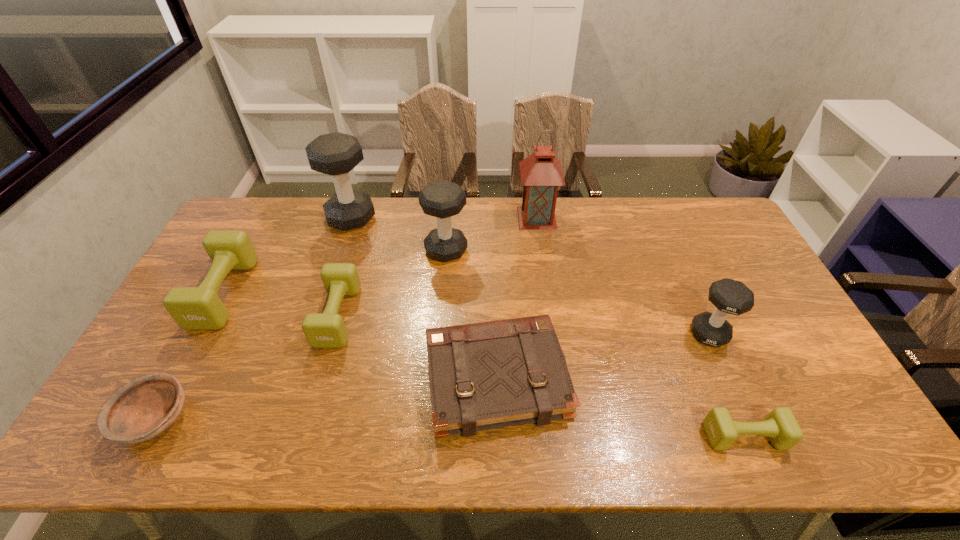
I want to click on olive dumbbell object that ranks as the closest to the fourth dumbbell from left to right, so click(322, 330).

Locate an element on the screen. This screenshot has width=960, height=540. vacant position in the image that satisfies the following two spatial constraints: 1. on the back side of the third tallest dumbbell; 2. on the left side of the brown bowl is located at coordinates (202, 334).

Where is `free space that satisfies the following two spatial constraints: 1. on the back side of the leftmost olive dumbbell; 2. on the right side of the pink lantern`? The image size is (960, 540). free space that satisfies the following two spatial constraints: 1. on the back side of the leftmost olive dumbbell; 2. on the right side of the pink lantern is located at coordinates [x=264, y=218].

Find the location of a particular element. Image resolution: width=960 pixels, height=540 pixels. free region that satisfies the following two spatial constraints: 1. on the back side of the brown bowl; 2. on the right side of the nearest gray dumbbell is located at coordinates (202, 334).

Identify the location of vacant space that satisfies the following two spatial constraints: 1. on the back side of the hardback book; 2. on the left side of the rightmost gray dumbbell. (495, 334).